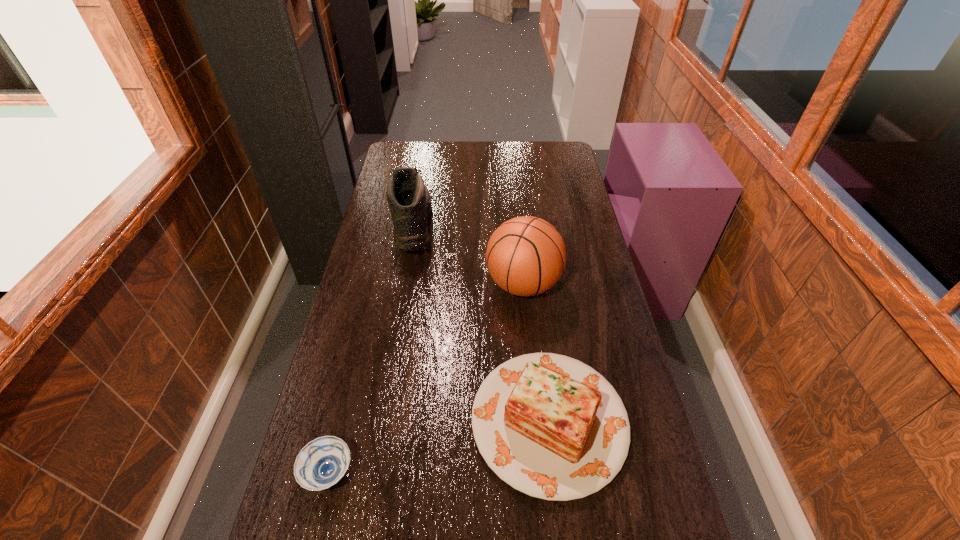
Locate an element on the screen. The height and width of the screenshot is (540, 960). basketball located at the right edge is located at coordinates [526, 256].

Where is `lasagna that is at the right edge`? The image size is (960, 540). lasagna that is at the right edge is located at coordinates (550, 426).

Image resolution: width=960 pixels, height=540 pixels. Find the location of `vacant space at the far edge of the desktop`. vacant space at the far edge of the desktop is located at coordinates pyautogui.click(x=444, y=147).

Image resolution: width=960 pixels, height=540 pixels. Identify the location of blank space at the left edge of the desktop. (363, 285).

At what (x,y) coordinates should I click in order to perform the action: click on free space at the right edge of the desktop. Please return your answer as a coordinate pair (x, y). The width and height of the screenshot is (960, 540). Looking at the image, I should click on (570, 167).

You are a GUI agent. You are given a task and a screenshot of the screen. Output one action in this format:
    pyautogui.click(x=<x>, y=<y>)
    Task: Click on the unoccupied area between the soup bowl and the basketball
    The image size is (960, 540).
    Given the screenshot: What is the action you would take?
    pyautogui.click(x=425, y=378)

The height and width of the screenshot is (540, 960). What are the coordinates of `empty space between the basketball and the shortest object` in the screenshot? It's located at (425, 378).

Find the location of `free space between the basketball and the shortest object`. free space between the basketball and the shortest object is located at coordinates (425, 378).

The image size is (960, 540). In order to click on unoccupied area between the second shortest object and the ski boot in this screenshot , I will do (x=481, y=323).

The width and height of the screenshot is (960, 540). I want to click on free point between the lasagna and the soup bowl, so click(439, 447).